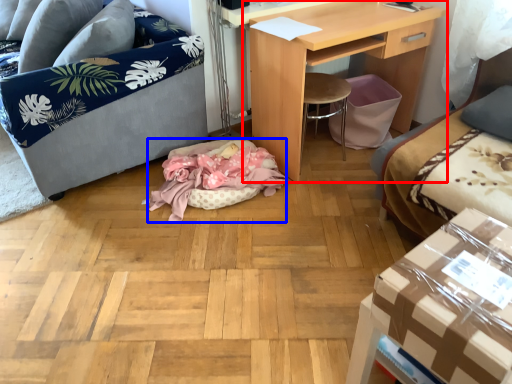
Question: Among these objects, which one is farthest to the camera, desk (highlighted by a red box) or cat bed (highlighted by a blue box)?

Choices:
 (A) desk
 (B) cat bed

Answer: (B)